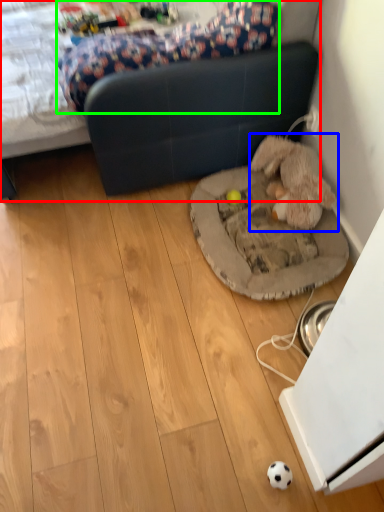
Question: Which object is positioned farthest from studio couch (highlighted by a red box)? Select from toy (highlighted by a blue box) and mattress (highlighted by a green box).

Choices:
 (A) toy
 (B) mattress

Answer: (A)